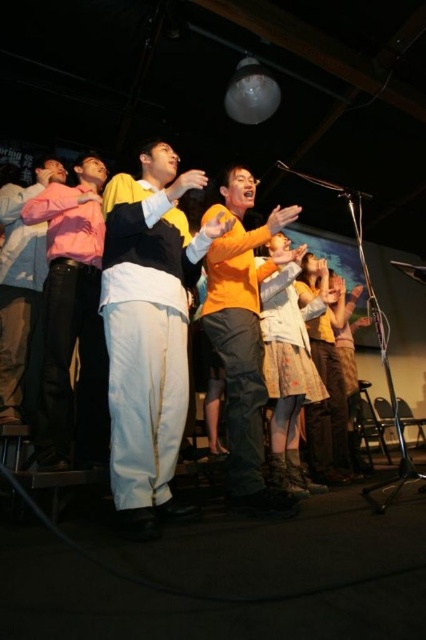
You are a stagehand preparing to adjust the lighting for the performers. You notice the white cotton pants at center and the orange matte shirt at center. Which clothing item is covering the other one?

The white cotton pants at center is positioned over orange matte shirt at center, so the white cotton pants are covering the orange matte shirt.

You are standing in the same room as the pink matte shirt at left. If you want to give them a high five, will you be able to reach them without moving closer?

The pink matte shirt at left and viewer are 2.21 meters apart from each other. The average human arm span is about 1.5 meters, so you would need to move closer to reach them for a high five.